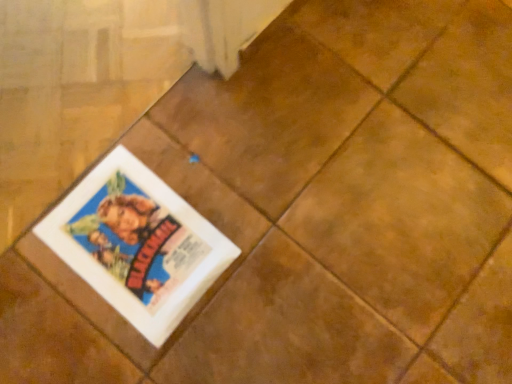
The width and height of the screenshot is (512, 384). What are the coordinates of `free space above white paper magazine at center (from a real-world perspective)` in the screenshot? It's located at (137, 235).